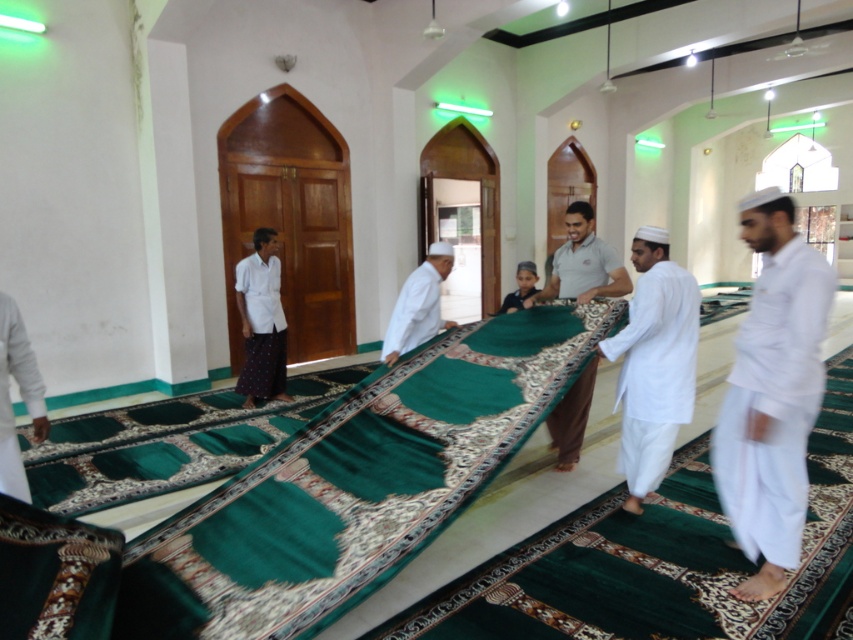
Question: Is white cotton shirt at center below white matte robe at lower left?

Choices:
 (A) no
 (B) yes

Answer: (A)

Question: Considering the real-world distances, which object is closest to the white cotton shirt at center?

Choices:
 (A) white matte prayer mat at center
 (B) white cotton robe at center
 (C) white matte clothing at right

Answer: (A)

Question: Does white cotton shirt at center appear over white matte prayer mat at center?

Choices:
 (A) yes
 (B) no

Answer: (A)

Question: Which object is closer to the camera taking this photo?

Choices:
 (A) white cotton robe at center
 (B) dark green fabric at center

Answer: (B)

Question: Is white cotton shirt at center thinner than white cotton robe at center?

Choices:
 (A) yes
 (B) no

Answer: (B)

Question: Which of these objects is positioned farthest from the white cotton shirt at center?

Choices:
 (A) white matte robe at lower left
 (B) white cotton kufi at center
 (C) white cotton robe at center

Answer: (A)